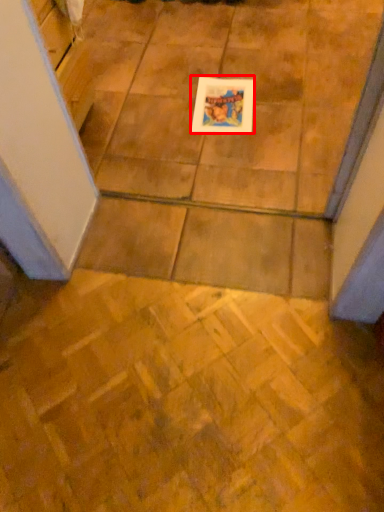
Question: Where is picture frame (annotated by the red box) located in relation to ceramic tile in the image?

Choices:
 (A) right
 (B) left

Answer: (A)